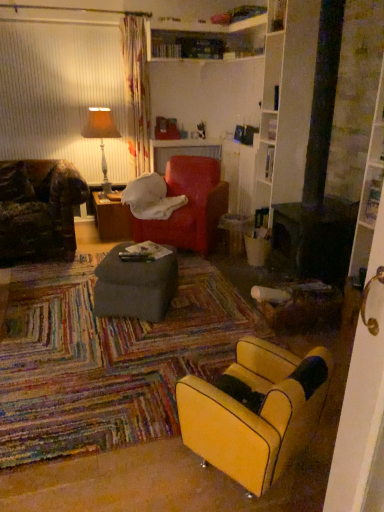
Image resolution: width=384 pixels, height=512 pixels. Describe the element at coordinates (189, 206) in the screenshot. I see `velvet red bean bag chair at center` at that location.

The image size is (384, 512). What do you see at coordinates (111, 218) in the screenshot?
I see `brown wood table at center, which is counted as the first table, starting from the back` at bounding box center [111, 218].

Describe the element at coordinates (254, 413) in the screenshot. I see `yellow leather chair at lower right` at that location.

This screenshot has width=384, height=512. What do you see at coordinates (135, 286) in the screenshot? I see `matte gray ottoman at center, the first table viewed from the front` at bounding box center [135, 286].

At what (x,y) coordinates should I click in order to perform the action: click on velvet red bean bag chair at center. Please return your answer as a coordinate pair (x, y). Looking at the image, I should click on (189, 206).

Is orange fabric lampshade at upper left completely or partially inside velvet red bean bag chair at center?

No, orange fabric lampshade at upper left is not inside velvet red bean bag chair at center.

Which is in front, velvet red bean bag chair at center or orange fabric lampshade at upper left?

velvet red bean bag chair at center is more forward.

In the scene shown: Considering the sizes of velvet red bean bag chair at center and orange fabric lampshade at upper left in the image, is velvet red bean bag chair at center bigger or smaller than orange fabric lampshade at upper left?

Clearly, velvet red bean bag chair at center is larger in size than orange fabric lampshade at upper left.

Can you tell me how much brown wood table at center, the second table when ordered from right to left, and yellow leather chair at lower right differ in facing direction?

The angular difference between brown wood table at center, the second table when ordered from right to left, and yellow leather chair at lower right is 146 degrees.

Can you confirm if brown wood table at center, which ranks as the 1th table in left-to-right order, is bigger than yellow leather chair at lower right?

No, brown wood table at center, which ranks as the 1th table in left-to-right order, is not bigger than yellow leather chair at lower right.

Is brown wood table at center, which is counted as the first table, starting from the back, located outside yellow leather chair at lower right?

Yes, brown wood table at center, which is counted as the first table, starting from the back, is located beyond the bounds of yellow leather chair at lower right.

From the image's perspective, is matte gray ottoman at center, the 1th table from the bottom, located above velvet red bean bag chair at center?

Incorrect, from the image's perspective, matte gray ottoman at center, the 1th table from the bottom, is lower than velvet red bean bag chair at center.

Considering the points (104, 283) and (181, 170), which point is behind, point (104, 283) or point (181, 170)?

The point (181, 170) is farther from the camera.

Which object is more forward, matte gray ottoman at center, acting as the 2th table starting from the left, or velvet red bean bag chair at center?

matte gray ottoman at center, acting as the 2th table starting from the left, is more forward.

Does matte gray ottoman at center, the first table viewed from the front, appear on the right side of velvet red bean bag chair at center?

In fact, matte gray ottoman at center, the first table viewed from the front, is to the left of velvet red bean bag chair at center.

Is brown wood table at center, which is the 2th table in bottom-to-top order, in front of orange fabric lampshade at upper left?

No, it is behind orange fabric lampshade at upper left.

What's the angular difference between brown wood table at center, which appears as the 2th table when viewed from the front, and orange fabric lampshade at upper left's facing directions?

There is a 0.000307-degree angle between the facing directions of brown wood table at center, which appears as the 2th table when viewed from the front, and orange fabric lampshade at upper left.

Can you confirm if brown wood table at center, which appears as the 2th table when viewed from the front, is wider than orange fabric lampshade at upper left?

Yes.

Is brown wood table at center, the second table when ordered from right to left, looking in the opposite direction of orange fabric lampshade at upper left?

No, orange fabric lampshade at upper left is not at the back of brown wood table at center, the second table when ordered from right to left.

Considering the relative positions of velvet red bean bag chair at center and matte gray ottoman at center, the 2th table in the back-to-front sequence, in the image provided, is velvet red bean bag chair at center behind matte gray ottoman at center, the 2th table in the back-to-front sequence,?

Yes, the depth of velvet red bean bag chair at center is greater than that of matte gray ottoman at center, the 2th table in the back-to-front sequence.

Does velvet red bean bag chair at center appear on the left side of matte gray ottoman at center, acting as the 2th table starting from the left?

No, velvet red bean bag chair at center is not to the left of matte gray ottoman at center, acting as the 2th table starting from the left.

Could you tell me if velvet red bean bag chair at center is turned towards matte gray ottoman at center, which appears as the second table when viewed from the top?

Yes.

How different are the orientations of velvet red bean bag chair at center and brown wood table at center, the second table when ordered from right to left, in degrees?

The angle between the facing direction of velvet red bean bag chair at center and the facing direction of brown wood table at center, the second table when ordered from right to left, is 35.8 degrees.

At what (x,y) coordinates should I click in order to perform the action: click on bean bag chair above the brown wood table at center, which is counted as the first table, starting from the back (from a real-world perspective). Please return your answer as a coordinate pair (x, y). Looking at the image, I should click on (189, 206).

Which point is more forward, (193, 214) or (115, 214)?

Point (193, 214)

In the scene shown: Is velvet red bean bag chair at center situated inside brown wood table at center, the first table when ordered from top to bottom, or outside?

velvet red bean bag chair at center is not enclosed by brown wood table at center, the first table when ordered from top to bottom.

Which is closer, (189, 421) or (186, 163)?

Clearly, point (189, 421) is closer to the camera than point (186, 163).

Between yellow leather chair at lower right and velvet red bean bag chair at center, which one has larger width?

velvet red bean bag chair at center is wider.

How many degrees apart are the facing directions of yellow leather chair at lower right and velvet red bean bag chair at center?

The facing directions of yellow leather chair at lower right and velvet red bean bag chair at center are 111 degrees apart.

You are a GUI agent. You are given a task and a screenshot of the screen. Output one action in this format:
    pyautogui.click(x=<x>, y=<y>)
    Task: Click on the bean bag chair that is below the orange fabric lampshade at upper left (from the image's perspective)
    
    Given the screenshot: What is the action you would take?
    coord(189,206)

Identify the location of chair in front of the brown wood table at center, the first table when ordered from top to bottom. (254, 413).

When comparing their distances from matte gray ottoman at center, the 2th table in the back-to-front sequence, does velvet red bean bag chair at center or orange fabric lampshade at upper left seem further?

orange fabric lampshade at upper left.

Which object lies further to the anchor point orange fabric lampshade at upper left, brown wood table at center, which is counted as the first table, starting from the back, or yellow leather chair at lower right?

yellow leather chair at lower right is further to orange fabric lampshade at upper left.

From the image, which object appears to be farther from orange fabric lampshade at upper left, yellow leather chair at lower right or matte gray ottoman at center, the 1th table from the bottom?

yellow leather chair at lower right.

Estimate the real-world distances between objects in this image. Which object is closer to matte gray ottoman at center, the 1th table from the bottom, yellow leather chair at lower right or velvet red bean bag chair at center?

velvet red bean bag chair at center lies closer to matte gray ottoman at center, the 1th table from the bottom, than the other object.

When comparing their distances from velvet red bean bag chair at center, does matte gray ottoman at center, the 2th table in the back-to-front sequence, or yellow leather chair at lower right seem closer?

matte gray ottoman at center, the 2th table in the back-to-front sequence, is positioned closer to the anchor velvet red bean bag chair at center.

From the image, which object appears to be nearer to matte gray ottoman at center, the 1th table from the bottom, brown wood table at center, which is the 2th table in bottom-to-top order, or yellow leather chair at lower right?

yellow leather chair at lower right is closer to matte gray ottoman at center, the 1th table from the bottom.

Looking at this image, estimate the real-world distances between objects in this image. Which object is closer to matte gray ottoman at center, the 1th table from the bottom, brown wood table at center, which ranks as the 1th table in left-to-right order, or orange fabric lampshade at upper left?

brown wood table at center, which ranks as the 1th table in left-to-right order, is positioned closer to the anchor matte gray ottoman at center, the 1th table from the bottom.

Consider the image. From the image, which object appears to be farther from velvet red bean bag chair at center, yellow leather chair at lower right or matte gray ottoman at center, the 1th table from the bottom?

yellow leather chair at lower right is further to velvet red bean bag chair at center.

Locate an element on the screen. The image size is (384, 512). bean bag chair between yellow leather chair at lower right and brown wood table at center, the first table when ordered from top to bottom, along the z-axis is located at coordinates (189, 206).

The width and height of the screenshot is (384, 512). What are the coordinates of `bean bag chair positioned between matte gray ottoman at center, which appears as the first table when viewed from the right, and orange fabric lampshade at upper left from near to far` in the screenshot? It's located at (189, 206).

Find the location of `bean bag chair between matte gray ottoman at center, the 2th table in the back-to-front sequence, and brown wood table at center, which ranks as the 1th table in left-to-right order, from front to back`. bean bag chair between matte gray ottoman at center, the 2th table in the back-to-front sequence, and brown wood table at center, which ranks as the 1th table in left-to-right order, from front to back is located at coordinates (189, 206).

The image size is (384, 512). In order to click on table between yellow leather chair at lower right and orange fabric lampshade at upper left along the z-axis in this screenshot , I will do `click(135, 286)`.